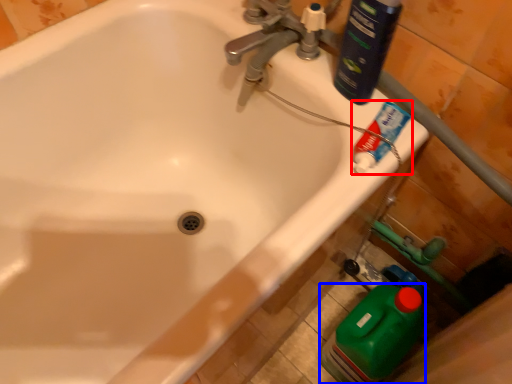
Question: Which object appears farthest to the camera in this image, toothpaste (highlighted by a red box) or cleaning product (highlighted by a blue box)?

Choices:
 (A) toothpaste
 (B) cleaning product

Answer: (B)